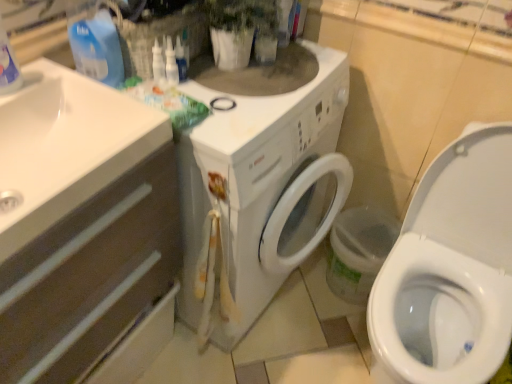
Question: Is white matte drawer at left wider or thinner than white glossy sink at left?

Choices:
 (A) wide
 (B) thin

Answer: (B)

Question: Based on their positions, is white matte drawer at left located to the left or right of white glossy sink at left?

Choices:
 (A) right
 (B) left

Answer: (B)

Question: Which object is positioned farthest from the white glossy sink at left?

Choices:
 (A) blue plastic bottle at upper left
 (B) white matte drawer at left

Answer: (A)

Question: Which of these objects is positioned farthest from the blue plastic bottle at upper left?

Choices:
 (A) white matte drawer at left
 (B) white glossy sink at left

Answer: (A)